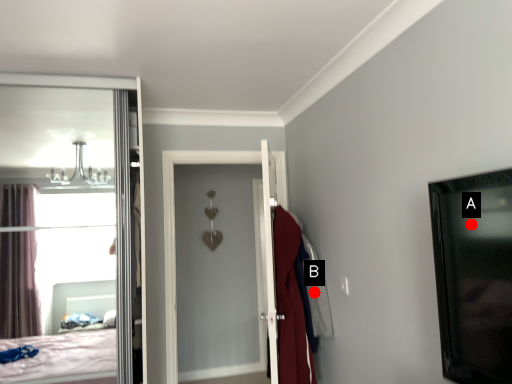
Question: Two points are circled on the image, labeled by A and B beside each circle. Which point is closer to the camera taking this photo?

Choices:
 (A) A is closer
 (B) B is closer

Answer: (A)